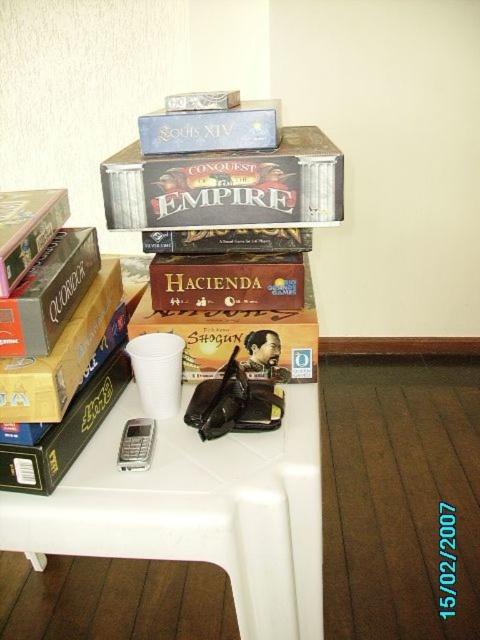
Between white plastic table at center and matte cardboard game at center, which one appears on the left side from the viewer's perspective?

white plastic table at center

Between point (167, 522) and point (303, 314), which one is positioned behind?

The point (303, 314) is more distant.

Where is `white plastic table at center`? Image resolution: width=480 pixels, height=640 pixels. white plastic table at center is located at coordinates 197,509.

Is matte black book at lower left taller than blue cardboard box at upper center?

Correct, matte black book at lower left is much taller as blue cardboard box at upper center.

Is matte black book at lower left further to camera compared to blue cardboard box at upper center?

That is False.

Between point (55, 435) and point (276, 125), which one is positioned in front?

Point (55, 435) is more forward.

I want to click on matte black book at lower left, so click(x=64, y=433).

Does matte cardboard game at center appear over brown matte board game at center?

Incorrect, matte cardboard game at center is not positioned above brown matte board game at center.

The height and width of the screenshot is (640, 480). Describe the element at coordinates (239, 339) in the screenshot. I see `matte cardboard game at center` at that location.

Identify the location of matte cardboard game at center. This screenshot has height=640, width=480. (239, 339).